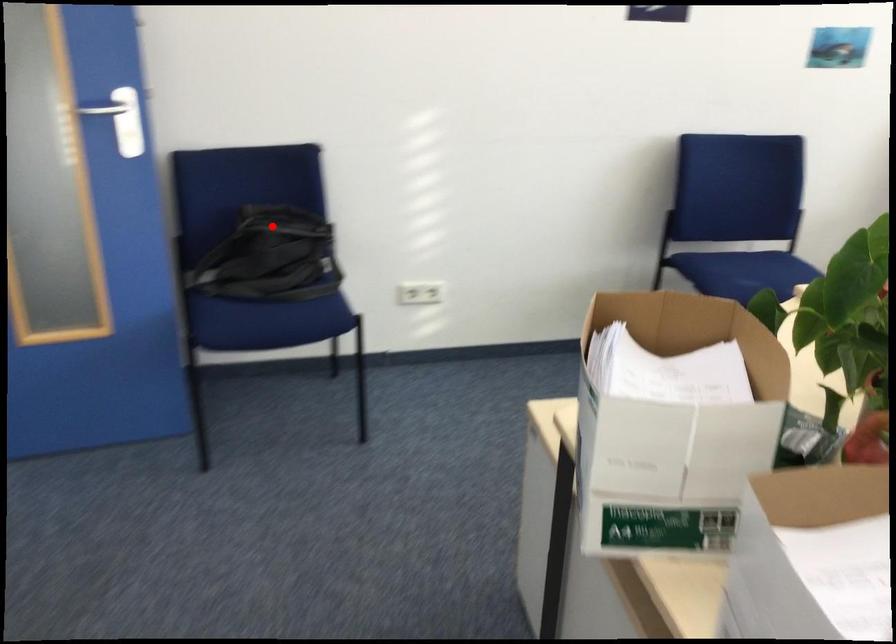
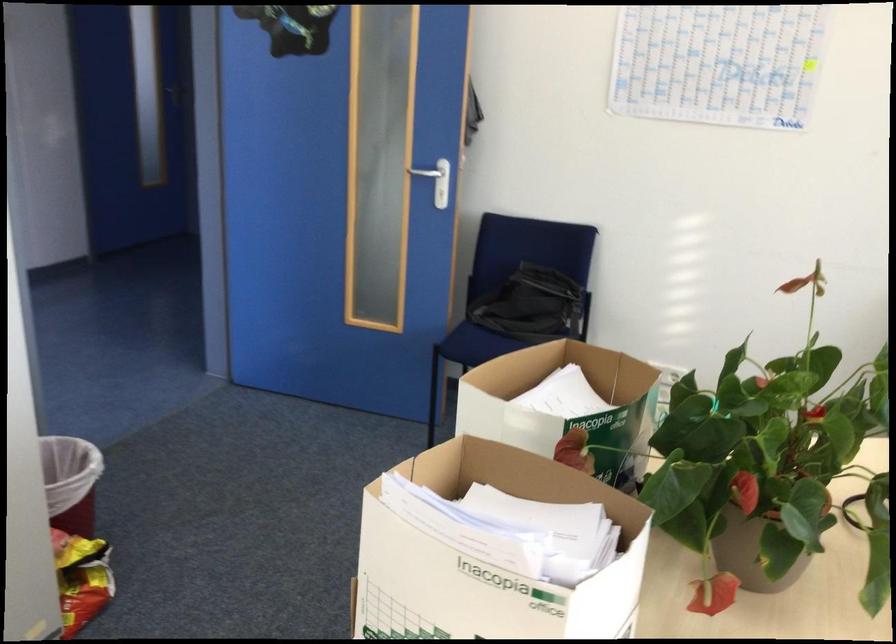
Question: I am providing you with two images of the same scene from different viewpoints. Given a red point in image1, look at the same physical point in image2. Is it:

Choices:
 (A) Closer to the viewpoint
 (B) Farther from the viewpoint

Answer: (B)